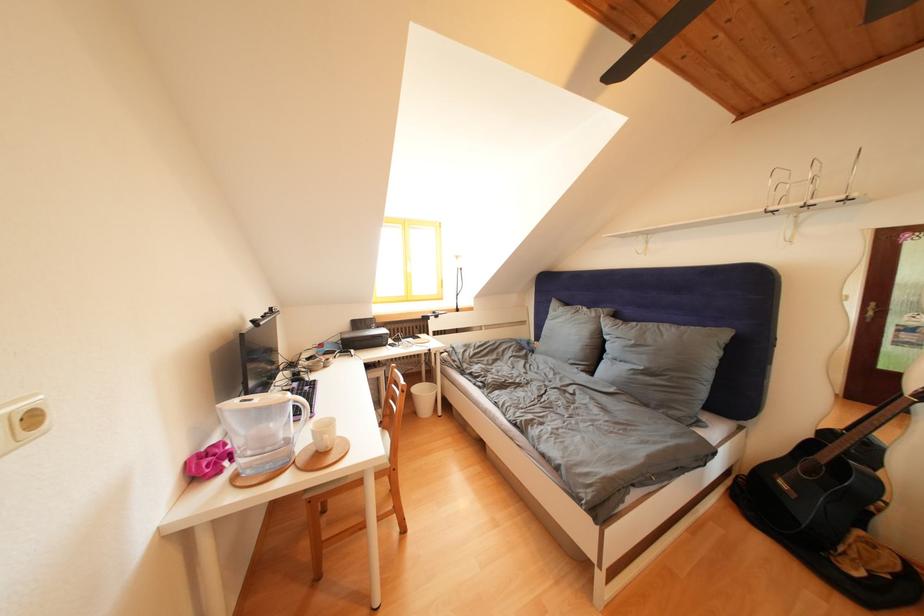
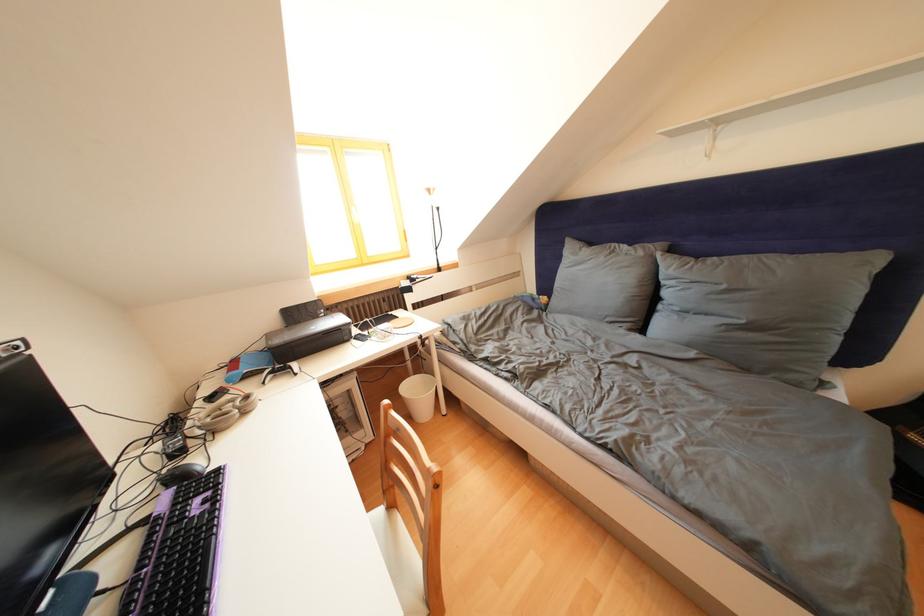
In the second image, find the point that corresponds to (640,347) in the first image.

(733, 292)